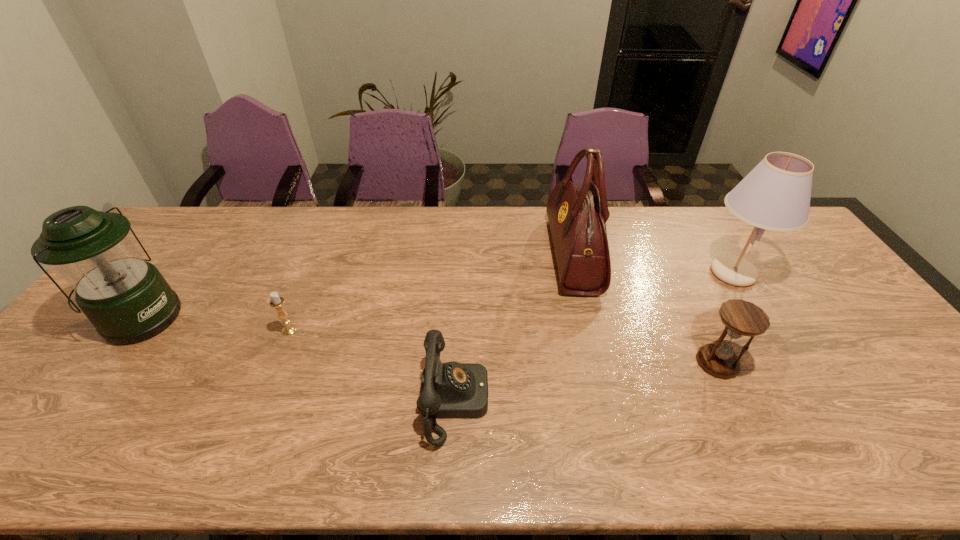
At what (x,y) coordinates should I click in order to perform the action: click on free location located on the front-facing side of the handbag. Please return your answer as a coordinate pair (x, y). The width and height of the screenshot is (960, 540). Looking at the image, I should click on (452, 255).

In order to click on vacant space located 0.130m on the front of the leftmost object in this screenshot , I will do `click(86, 389)`.

Locate an element on the screen. vacant space located 0.150m on the right of the second object from right to left is located at coordinates (797, 362).

The width and height of the screenshot is (960, 540). Identify the location of vacant point located 0.240m on the right of the fifth object from right to left. click(384, 330).

I want to click on free space located 0.350m on the dial of the third object from left to right, so click(x=636, y=400).

Find the location of `object present at the far edge`. object present at the far edge is located at coordinates (577, 215).

The width and height of the screenshot is (960, 540). What are the coordinates of `object that is positioned at the near edge` in the screenshot? It's located at (448, 390).

At what (x,y) coordinates should I click in order to perform the action: click on object present at the left edge. Please return your answer as a coordinate pair (x, y). Image resolution: width=960 pixels, height=540 pixels. Looking at the image, I should click on (126, 298).

You are a GUI agent. You are given a task and a screenshot of the screen. Output one action in this format:
    pyautogui.click(x=<x>, y=<y>)
    Task: Click on the vacant space at the far edge of the desktop
    
    Given the screenshot: What is the action you would take?
    pyautogui.click(x=368, y=233)

In the image, there is a desktop. At what (x,y) coordinates should I click in order to perform the action: click on vacant space at the near edge. Please return your answer as a coordinate pair (x, y). This screenshot has height=540, width=960. Looking at the image, I should click on (72, 435).